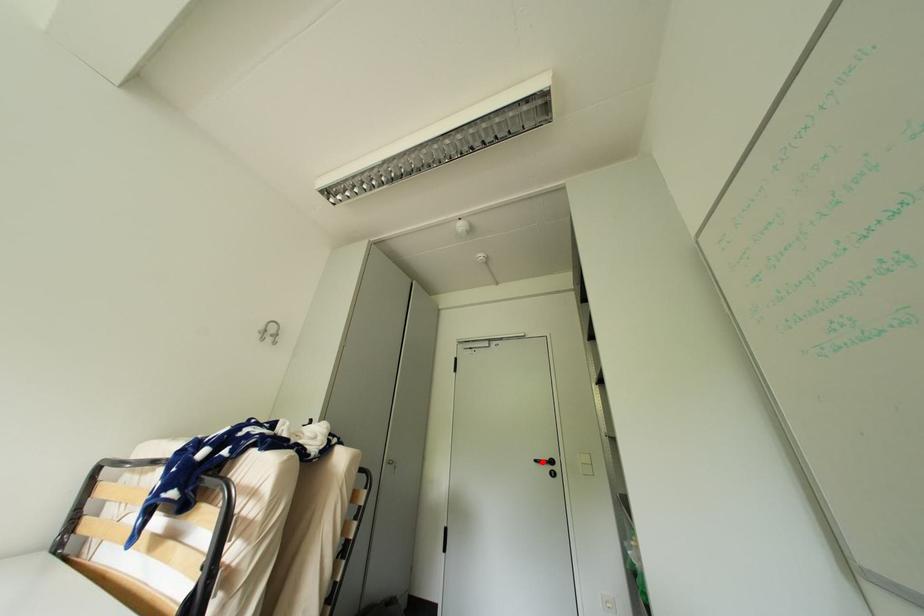
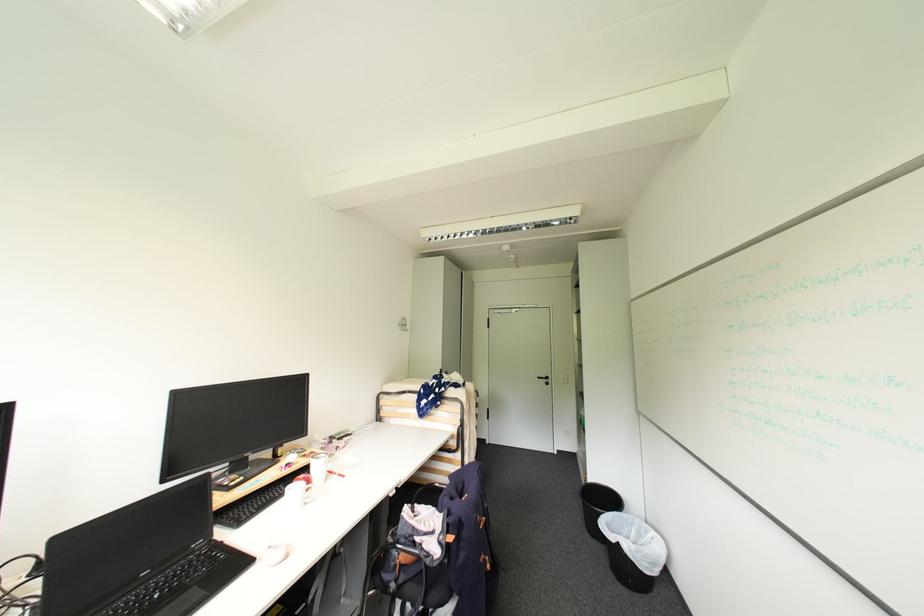
Locate, in the second image, the point that corresponds to the highlighted location in the first image.

(544, 379)